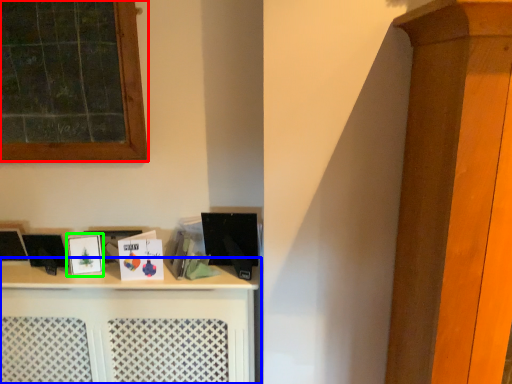
Question: Considering the real-world distances, which object is farthest from window (highlighted by a red box)? shelf (highlighted by a blue box) or picture frame (highlighted by a green box)?

Choices:
 (A) shelf
 (B) picture frame

Answer: (A)